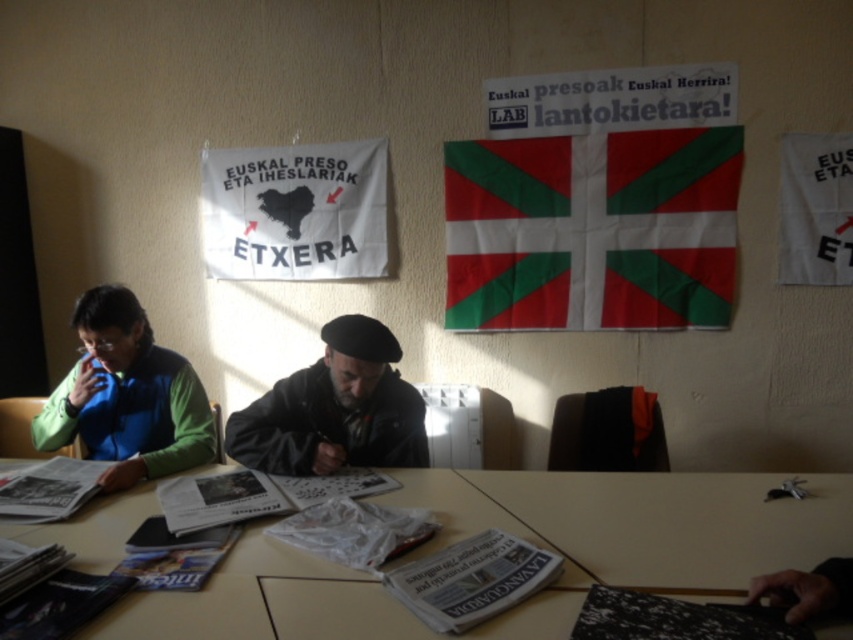
Which is below, green matte jacket at left or dark gray beret at center?

dark gray beret at center is lower down.

Is green matte jacket at left positioned in front of dark gray beret at center?

Yes, it is.

Does point (115, 426) come in front of point (331, 465)?

No, (115, 426) is further to viewer.

At what (x,y) coordinates should I click in order to perform the action: click on green matte jacket at left. Please return your answer as a coordinate pair (x, y). This screenshot has height=640, width=853. Looking at the image, I should click on (x=126, y=396).

Does wooden table at center appear on the right side of dark gray beret at center?

Indeed, wooden table at center is positioned on the right side of dark gray beret at center.

Measure the distance between wooden table at center and camera.

The distance of wooden table at center from camera is 1.14 meters.

I want to click on wooden table at center, so click(633, 531).

Is green and white fabric flag at upper center bigger than green matte jacket at left?

Correct, green and white fabric flag at upper center is larger in size than green matte jacket at left.

Between point (555, 168) and point (183, 442), which one is positioned in front?

Point (183, 442) is in front.

This screenshot has width=853, height=640. Identify the location of green and white fabric flag at upper center. (592, 230).